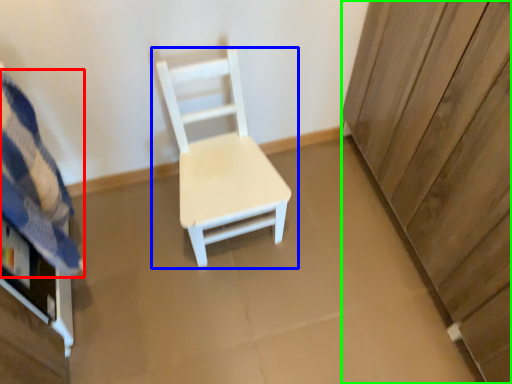
Question: Considering the real-world distances, which object is farthest from bedding (highlighted by a red box)? chair (highlighted by a blue box) or dresser (highlighted by a green box)?

Choices:
 (A) chair
 (B) dresser

Answer: (B)